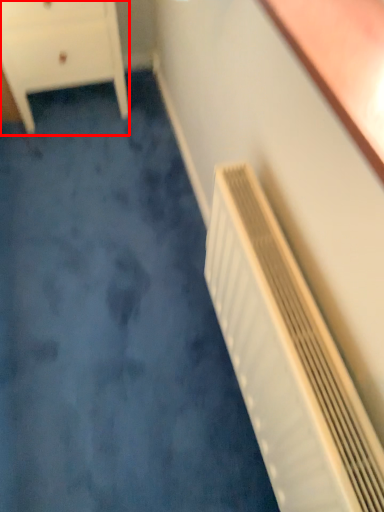
Question: From the image's perspective, what is the correct spatial positioning of chest of drawers (annotated by the red box) in reference to air conditioning?

Choices:
 (A) above
 (B) below

Answer: (A)